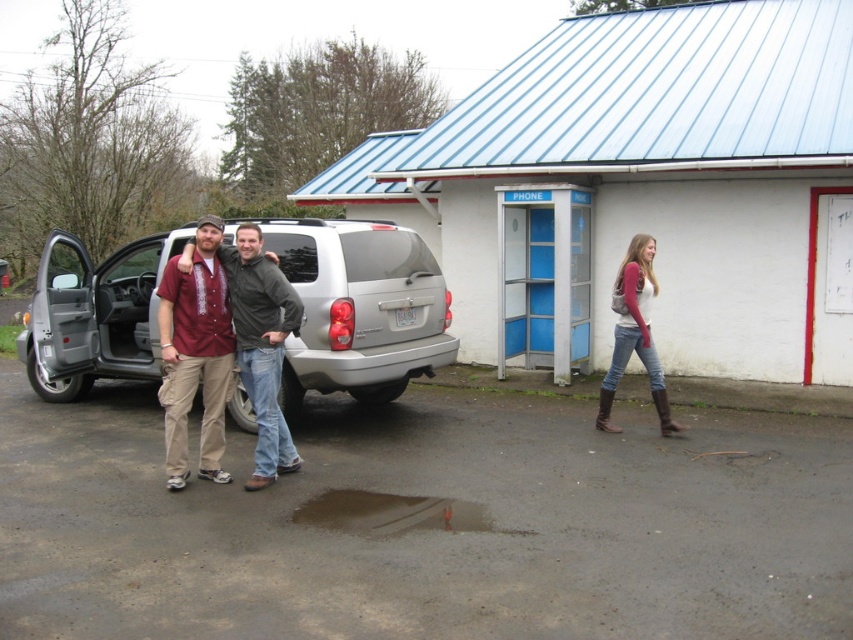
Question: Which point appears closest to the camera in this image?

Choices:
 (A) (432, 500)
 (B) (318, 369)

Answer: (A)

Question: Which of these objects is positioned farthest from the matte red shirt at center?

Choices:
 (A) brown matte puddle at lower center
 (B) silver metallic suv at center

Answer: (B)

Question: Does silver metallic suv at center have a larger size compared to matte red shirt at center?

Choices:
 (A) yes
 (B) no

Answer: (A)

Question: Is brown matte puddle at lower center further to the viewer compared to denim jeans at right?

Choices:
 (A) no
 (B) yes

Answer: (A)

Question: Which point is closer to the camera?

Choices:
 (A) (209, 419)
 (B) (637, 326)
 (C) (474, 531)
 (D) (363, 294)

Answer: (C)

Question: Is matte red shirt at center closer to camera compared to denim jeans at right?

Choices:
 (A) yes
 (B) no

Answer: (A)